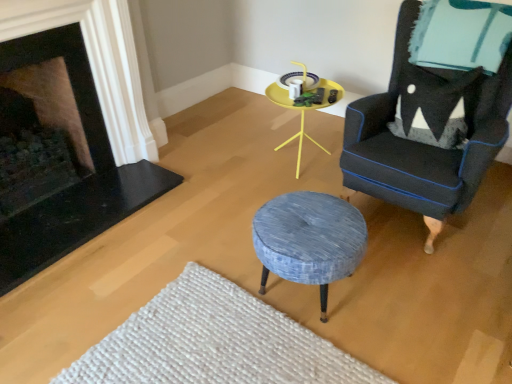
This screenshot has width=512, height=384. Identify the location of vacant area situated below yellow plastic table at center (from a real-world perspective). (310, 170).